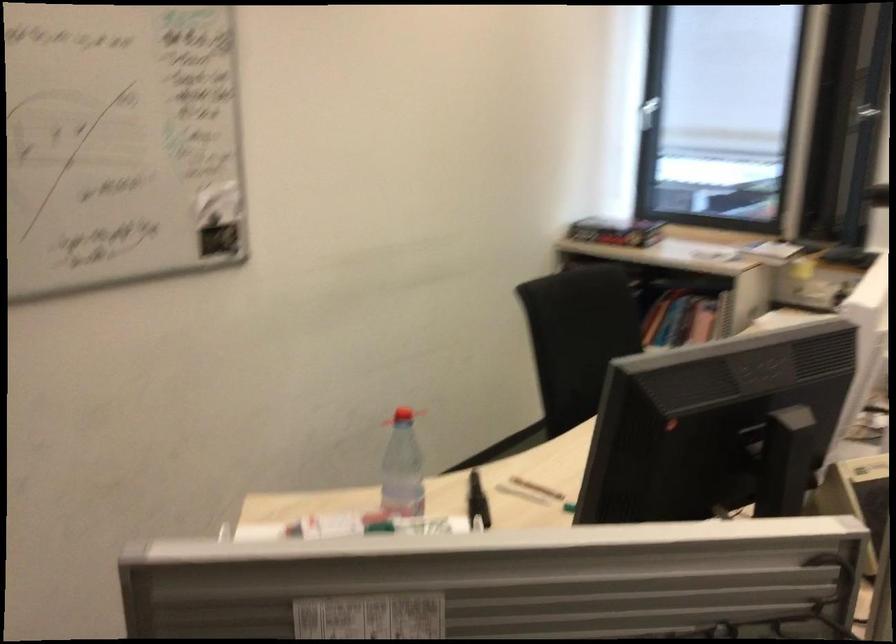
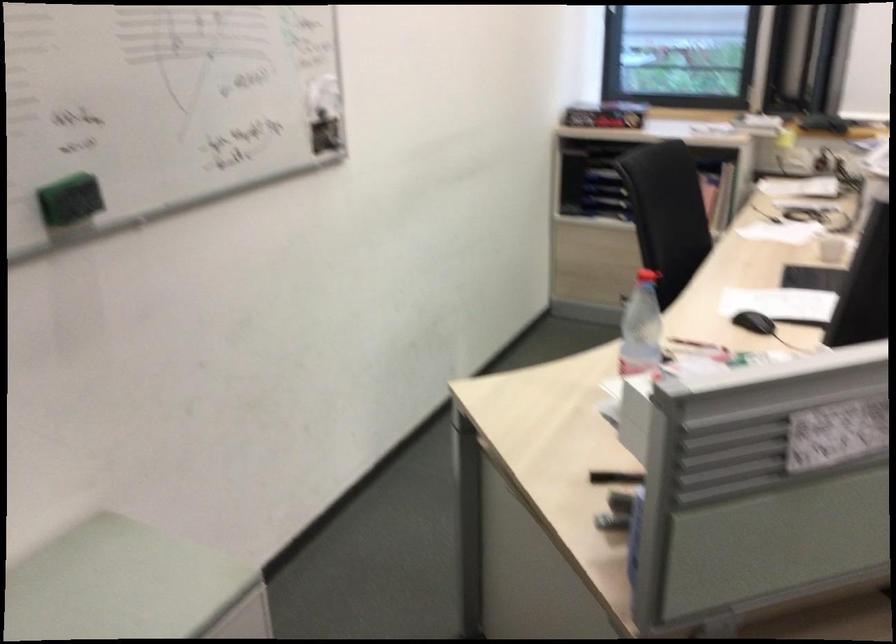
Question: How did the camera likely rotate?

Choices:
 (A) Left
 (B) Right
 (C) Up
 (D) Down

Answer: (B)